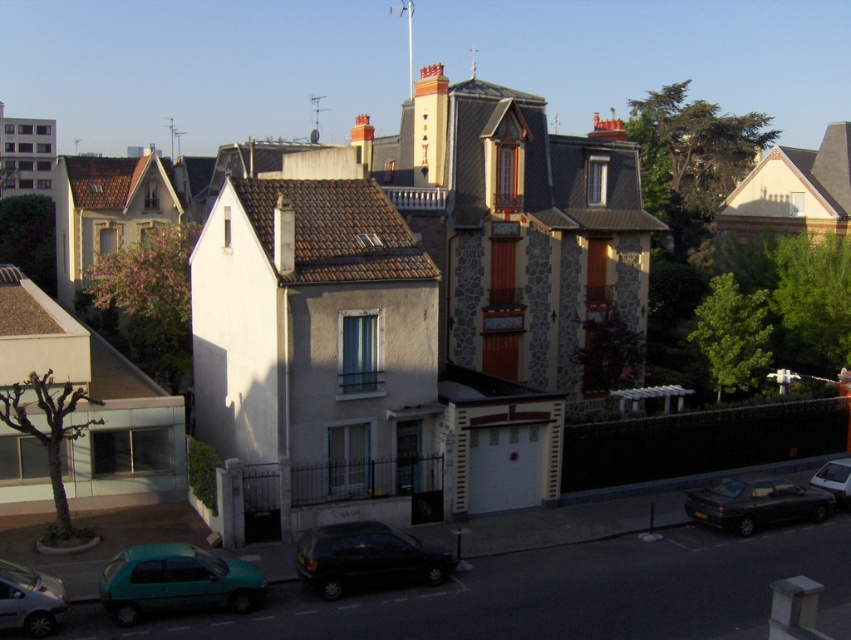
Can you confirm if shiny black sedan at lower center is smaller than metallic silver sedan at lower right?

Incorrect, shiny black sedan at lower center is not smaller in size than metallic silver sedan at lower right.

In the scene shown: Who is more distant from viewer, (386, 584) or (838, 472)?

Point (838, 472)

Locate an element on the screen. shiny black sedan at lower center is located at coordinates (366, 557).

This screenshot has height=640, width=851. Identify the location of shiny black sedan at lower center. (366, 557).

Between teal matte hatchback at lower left and metallic silver sedan at lower right, which one appears on the left side from the viewer's perspective?

From the viewer's perspective, teal matte hatchback at lower left appears more on the left side.

Is point (118, 605) less distant than point (844, 488)?

Yes, it is.

Where is `teal matte hatchback at lower left`? teal matte hatchback at lower left is located at coordinates (176, 580).

Where is `teal matte hatchback at lower left`? teal matte hatchback at lower left is located at coordinates (176, 580).

Between metallic teal hatchback at lower left and metallic silver sedan at lower right, which one is positioned higher?

Positioned higher is metallic silver sedan at lower right.

Is point (1, 625) behind point (844, 476)?

No.

Identify the location of metallic teal hatchback at lower left. (29, 600).